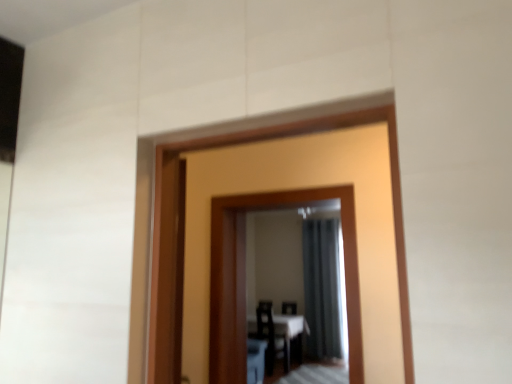
Consider the image. In order to face dark gray fabric curtain at center, should I rotate leftwards or rightwards?

To align with it, rotate right about 9.512°.

Locate an element on the screen. Image resolution: width=512 pixels, height=384 pixels. black plastic chair at center is located at coordinates (289, 308).

Is black plastic chair at center inside the boundaries of white glossy table at center, or outside?

black plastic chair at center exists outside the volume of white glossy table at center.

Between point (296, 309) and point (270, 316), which one is positioned behind?

The point (296, 309) is farther from the camera.

In terms of width, does black plastic chair at center look wider or thinner when compared to white glossy table at center?

Clearly, black plastic chair at center has less width compared to white glossy table at center.

Is black plastic chair at center to the right of white glossy table at center from the viewer's perspective?

Correct, you'll find black plastic chair at center to the right of white glossy table at center.

From the picture: Which is closer to the camera, (x=289, y=310) or (x=248, y=201)?

Point (x=289, y=310).

From a real-world perspective, is black plastic chair at center physically located above or below wooden mirror at center?

From a real-world perspective, black plastic chair at center is physically below wooden mirror at center.

Looking at their sizes, would you say black plastic chair at center is wider or thinner than wooden mirror at center?

Clearly, black plastic chair at center has less width compared to wooden mirror at center.

Considering the positions of objects black plastic chair at center and wooden mirror at center in the image provided, who is more to the right, black plastic chair at center or wooden mirror at center?

Positioned to the right is black plastic chair at center.

From a real-world perspective, relative to white glossy table at center, is wooden mirror at center vertically above or below?

In terms of real-world spatial position, wooden mirror at center is above white glossy table at center.

Find the location of a particular element. This screenshot has height=384, width=512. table on the right of wooden mirror at center is located at coordinates (282, 333).

Who is taller, wooden mirror at center or white glossy table at center?

Standing taller between the two is wooden mirror at center.

Looking at this image, from the image's perspective, between white glossy table at center and wooden mirror at center, which one is located above?

wooden mirror at center appears higher in the image.

Is white glossy table at center spatially inside wooden mirror at center, or outside of it?

The correct answer is: outside.

From a real-world perspective, which object rests below the other?

white glossy table at center, from a real-world perspective.

The height and width of the screenshot is (384, 512). What are the coordinates of `mirror above the white glossy table at center (from a real-world perspective)` in the screenshot? It's located at (244, 275).

How distant is black plastic chair at center from dark gray fabric curtain at center?

black plastic chair at center and dark gray fabric curtain at center are 65.37 centimeters apart from each other.

From their relative heights in the image, would you say black plastic chair at center is taller or shorter than dark gray fabric curtain at center?

Clearly, black plastic chair at center is shorter compared to dark gray fabric curtain at center.

From a real-world perspective, is black plastic chair at center physically located above or below dark gray fabric curtain at center?

From a real-world perspective, black plastic chair at center is physically below dark gray fabric curtain at center.

Is black plastic chair at center located outside dark gray fabric curtain at center?

Absolutely, black plastic chair at center is external to dark gray fabric curtain at center.

Can you tell me how much dark gray fabric curtain at center and wooden mirror at center differ in facing direction?

dark gray fabric curtain at center and wooden mirror at center are facing 0.776 degrees away from each other.

Are dark gray fabric curtain at center and wooden mirror at center making contact?

dark gray fabric curtain at center and wooden mirror at center are not in contact.

Considering the sizes of objects dark gray fabric curtain at center and wooden mirror at center in the image provided, who is bigger, dark gray fabric curtain at center or wooden mirror at center?

Bigger between the two is dark gray fabric curtain at center.

Is white glossy table at center facing away from dark gray fabric curtain at center?

That's not correct — white glossy table at center is not looking away from dark gray fabric curtain at center.

From the image's perspective, who appears lower, white glossy table at center or dark gray fabric curtain at center?

white glossy table at center, from the image's perspective.

Considering the points (287, 346) and (310, 258), which point is behind, point (287, 346) or point (310, 258)?

The point (310, 258) is farther.

Between white glossy table at center and dark gray fabric curtain at center, which one has larger size?

With larger size is dark gray fabric curtain at center.

Find the location of a particular element. Image resolution: width=512 pixels, height=384 pixels. table in front of the black plastic chair at center is located at coordinates (282, 333).

Where is `mirror that is on the left side of black plastic chair at center`? This screenshot has height=384, width=512. mirror that is on the left side of black plastic chair at center is located at coordinates (244, 275).

Estimate the real-world distances between objects in this image. Which object is closer to black plastic chair at center, dark gray fabric curtain at center or wooden mirror at center?

The object closer to black plastic chair at center is dark gray fabric curtain at center.

Which object lies nearer to the anchor point white glossy table at center, dark gray fabric curtain at center or black plastic chair at center?

black plastic chair at center lies closer to white glossy table at center than the other object.

Looking at this image, considering their positions, is dark gray fabric curtain at center positioned further to white glossy table at center than wooden mirror at center?

wooden mirror at center.

Which object lies nearer to the anchor point dark gray fabric curtain at center, wooden mirror at center or white glossy table at center?

The object closer to dark gray fabric curtain at center is white glossy table at center.

Estimate the real-world distances between objects in this image. Which object is further from white glossy table at center, black plastic chair at center or dark gray fabric curtain at center?

dark gray fabric curtain at center lies further to white glossy table at center than the other object.

Estimate the real-world distances between objects in this image. Which object is closer to dark gray fabric curtain at center, wooden mirror at center or black plastic chair at center?

black plastic chair at center is positioned closer to the anchor dark gray fabric curtain at center.

Based on their spatial positions, is white glossy table at center or black plastic chair at center closer to wooden mirror at center?

white glossy table at center is positioned closer to the anchor wooden mirror at center.

Based on their spatial positions, is dark gray fabric curtain at center or white glossy table at center closer to black plastic chair at center?

white glossy table at center.

Where is `table positioned between wooden mirror at center and dark gray fabric curtain at center from near to far`? The width and height of the screenshot is (512, 384). table positioned between wooden mirror at center and dark gray fabric curtain at center from near to far is located at coordinates (282, 333).

At what (x,y) coordinates should I click in order to perform the action: click on curtain between white glossy table at center and black plastic chair at center in the front-back direction. Please return your answer as a coordinate pair (x, y). The width and height of the screenshot is (512, 384). Looking at the image, I should click on (323, 288).

Find the location of `table between wooden mirror at center and black plastic chair at center in the front-back direction`. table between wooden mirror at center and black plastic chair at center in the front-back direction is located at coordinates (282, 333).

This screenshot has width=512, height=384. Find the location of `curtain positioned between wooden mirror at center and black plastic chair at center from near to far`. curtain positioned between wooden mirror at center and black plastic chair at center from near to far is located at coordinates (323, 288).